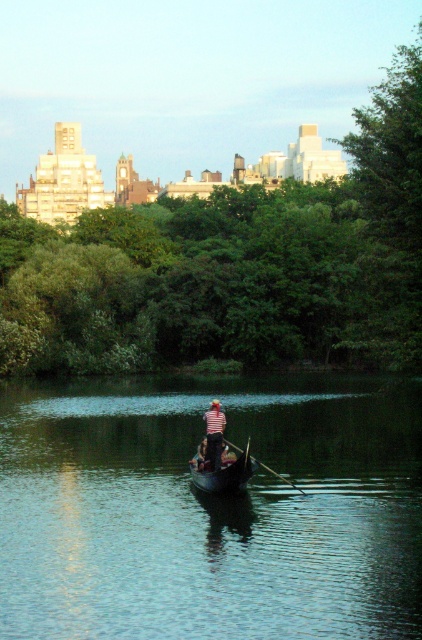
Between dark brown wooden canoe at center and wooden polished paddle at center, which one is positioned higher?

Positioned higher is dark brown wooden canoe at center.

Which is more to the left, dark brown wooden canoe at center or wooden polished paddle at center?

Positioned to the left is dark brown wooden canoe at center.

Does point (192, 472) lie in front of point (232, 444)?

Yes, it is in front of point (232, 444).

Locate an element on the screen. This screenshot has width=422, height=640. dark brown wooden canoe at center is located at coordinates point(224,472).

Which of these two, green smooth water at center or wooden polished paddle at center, stands shorter?

Standing shorter between the two is wooden polished paddle at center.

Does green smooth water at center have a greater width compared to wooden polished paddle at center?

Yes, green smooth water at center is wider than wooden polished paddle at center.

You are a GUI agent. You are given a task and a screenshot of the screen. Output one action in this format:
    pyautogui.click(x=<x>, y=<y>)
    Task: Click on the green smooth water at center
    This screenshot has width=422, height=640.
    Given the screenshot: What is the action you would take?
    pyautogui.click(x=211, y=509)

Can you confirm if green smooth water at center is shorter than striped fabric person at center?

No, green smooth water at center is not shorter than striped fabric person at center.

Does green smooth water at center have a greater width compared to striped fabric person at center?

Correct, the width of green smooth water at center exceeds that of striped fabric person at center.

Is point (165, 477) positioned in front of point (213, 465)?

No, it is behind (213, 465).

Find the location of a particular element. The width and height of the screenshot is (422, 640). green smooth water at center is located at coordinates (211, 509).